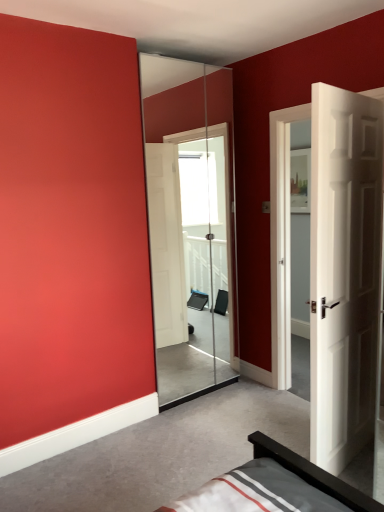
Where is `vacant space in front of transparent glass screen door at center`? vacant space in front of transparent glass screen door at center is located at coordinates (207, 424).